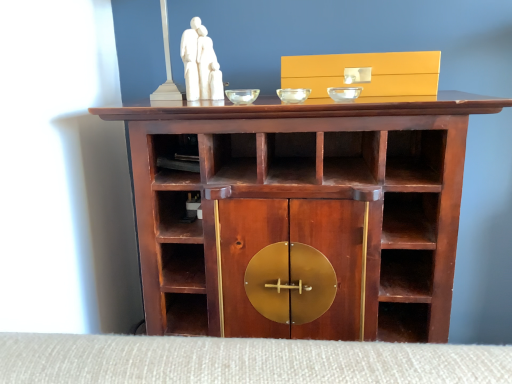
The width and height of the screenshot is (512, 384). Find the location of `vacant space behind transparent glass bowl at center, acting as the first glass bowl starting from the right`. vacant space behind transparent glass bowl at center, acting as the first glass bowl starting from the right is located at coordinates (331, 89).